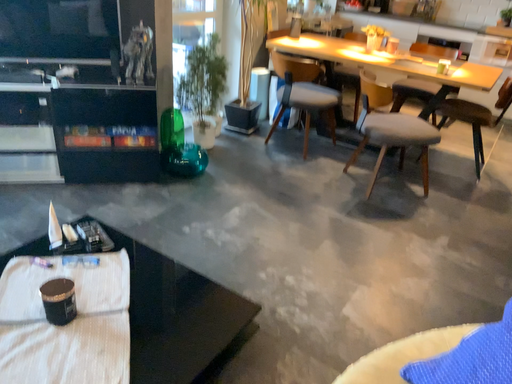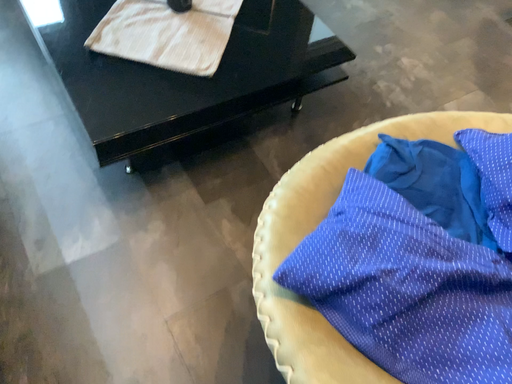
Question: Which way did the camera rotate in the video?

Choices:
 (A) rotated left
 (B) rotated right

Answer: (A)